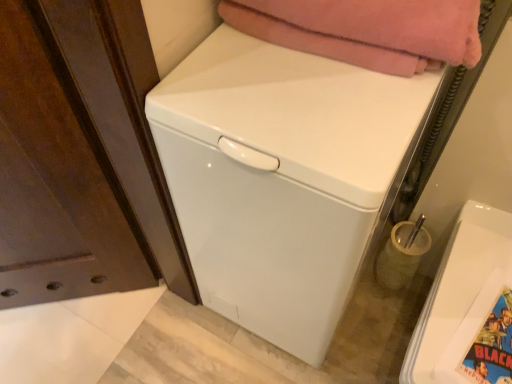
Question: Looking at the image, does white glossy washing machine at center, positioned as the 2th washing machine in right-to-left order, seem bigger or smaller compared to soft pink blanket at upper center?

Choices:
 (A) small
 (B) big

Answer: (B)

Question: Considering the positions of point (187, 150) and point (407, 26), is point (187, 150) closer or farther from the camera than point (407, 26)?

Choices:
 (A) closer
 (B) farther

Answer: (B)

Question: Which of these objects is positioned closest to the translucent glass toothbrush holder at lower right?

Choices:
 (A) soft pink blanket at upper center
 (B) white glossy washing machine at lower right, which is the first washing machine in right-to-left order
 (C) white glossy washing machine at center, the first washing machine from the left
 (D) colorful glossy comic book at lower right

Answer: (B)

Question: Which object is the farthest from the translucent glass toothbrush holder at lower right?

Choices:
 (A) colorful glossy comic book at lower right
 (B) white glossy washing machine at center, positioned as the 2th washing machine in right-to-left order
 (C) white glossy washing machine at lower right, which is the first washing machine in right-to-left order
 (D) soft pink blanket at upper center

Answer: (D)